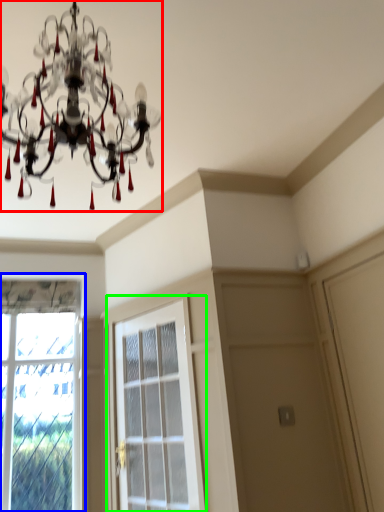
Question: Based on their relative distances, which object is nearer to lamp (highlighted by a red box)? Choose from window (highlighted by a blue box) and screen door (highlighted by a green box).

Choices:
 (A) window
 (B) screen door

Answer: (B)